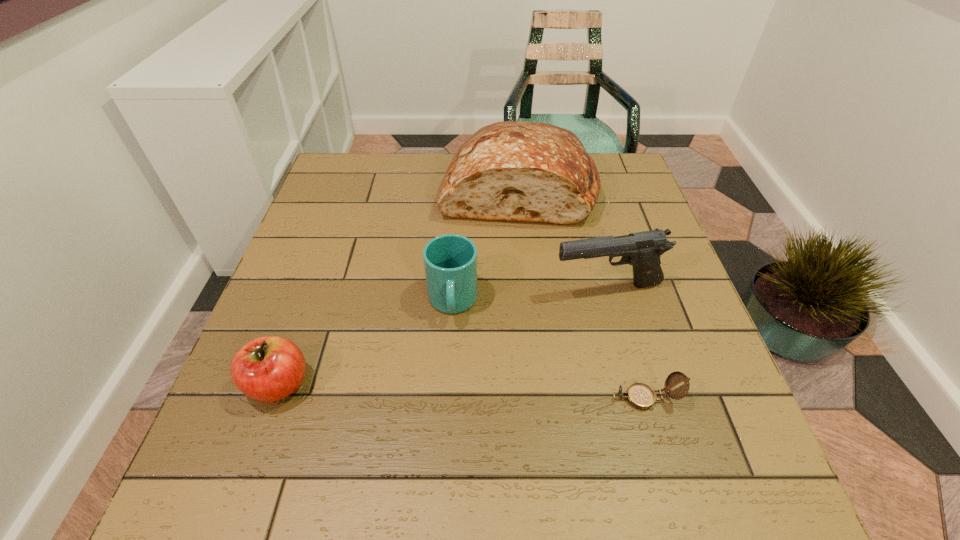
This screenshot has height=540, width=960. I want to click on empty space between the shortest object and the leftmost object, so click(x=462, y=391).

I want to click on free space between the compass and the tallest object, so click(x=582, y=293).

This screenshot has height=540, width=960. Find the location of `vacant region between the cup and the shortest object`. vacant region between the cup and the shortest object is located at coordinates (549, 350).

Identify the location of vacant area that lies between the compass and the tallest object. (582, 293).

This screenshot has height=540, width=960. Identify the location of unoccupied position between the gun and the compass. (627, 344).

Locate an element on the screen. The width and height of the screenshot is (960, 540). free spot between the tallest object and the cup is located at coordinates (485, 245).

Select which object appears as the fourth closest to the cup. Please provide its 2D coordinates. Your answer should be formatted as a tuple, i.e. [(x, y)], where the tuple contains the x and y coordinates of a point satisfying the conditions above.

[(639, 395)]

Choose which object is the nearest neighbor to the bread. Please provide its 2D coordinates. Your answer should be formatted as a tuple, i.e. [(x, y)], where the tuple contains the x and y coordinates of a point satisfying the conditions above.

[(642, 250)]

I want to click on free space that satisfies the following two spatial constraints: 1. on the front side of the fourth tallest object; 2. on the face of the compass, so click(x=274, y=398).

You are a GUI agent. You are given a task and a screenshot of the screen. Output one action in this format:
    pyautogui.click(x=<x>, y=<y>)
    Task: Click on the vacant point that satisfies the following two spatial constraints: 1. on the front side of the farthest object; 2. on the face of the shortest object
    
    Given the screenshot: What is the action you would take?
    pyautogui.click(x=539, y=398)